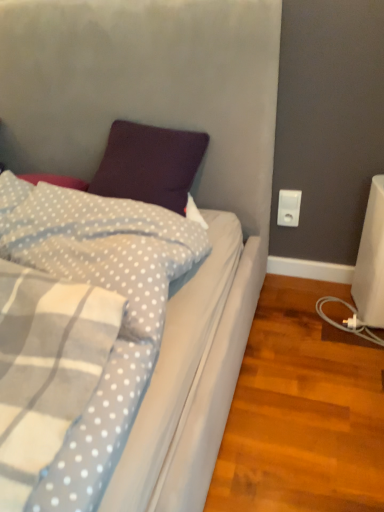
Locate an element on the screen. light purple plush pillow at upper left is located at coordinates (101, 245).

Describe the element at coordinates (101, 245) in the screenshot. The image size is (384, 512). I see `light purple plush pillow at upper left` at that location.

You are a GUI agent. You are given a task and a screenshot of the screen. Output one action in this format:
    pyautogui.click(x=<x>, y=<y>)
    Task: Click on the white plastic power plug at right
    This screenshot has height=512, width=384.
    Given the screenshot: What is the action you would take?
    pyautogui.click(x=289, y=208)

What do you see at coordinates (289, 208) in the screenshot? The width and height of the screenshot is (384, 512). I see `white plastic power plug at right` at bounding box center [289, 208].

Based on the photo, measure the distance between point (280, 204) and camera.

Point (280, 204) and camera are 5.63 feet apart.

You are a GUI agent. You are given a task and a screenshot of the screen. Output one action in this format:
    pyautogui.click(x=<x>, y=<y>)
    Task: Click on the light purple plush pillow at upper left
    
    Given the screenshot: What is the action you would take?
    pyautogui.click(x=101, y=245)

Is white plastic power plug at right to the left or to the right of light purple plush pillow at upper left in the image?

Based on their positions, white plastic power plug at right is located to the right of light purple plush pillow at upper left.

Is the position of white plastic power plug at right less distant than that of light purple plush pillow at upper left?

That is False.

Considering the positions of point (294, 206) and point (70, 242), is point (294, 206) closer or farther from the camera than point (70, 242)?

Point (294, 206) is positioned farther from the camera compared to point (70, 242).

From the image's perspective, which one is positioned higher, white plastic power plug at right or light purple plush pillow at upper left?

white plastic power plug at right appears higher in the image.

From a real-world perspective, which is physically above, white plastic power plug at right or light purple plush pillow at upper left?

light purple plush pillow at upper left, from a real-world perspective.

Which object is thinner, white plastic power plug at right or light purple plush pillow at upper left?

With smaller width is white plastic power plug at right.

Considering the relative sizes of white plastic power plug at right and light purple plush pillow at upper left in the image provided, is white plastic power plug at right taller than light purple plush pillow at upper left?

No.

Based on the photo, considering the sizes of white plastic power plug at right and light purple plush pillow at upper left in the image, is white plastic power plug at right bigger or smaller than light purple plush pillow at upper left?

In the image, white plastic power plug at right appears to be smaller than light purple plush pillow at upper left.

Is white plastic power plug at right not inside light purple plush pillow at upper left?

Indeed, white plastic power plug at right is completely outside light purple plush pillow at upper left.

Is white plastic power plug at right directly adjacent to light purple plush pillow at upper left?

No, white plastic power plug at right is not next to light purple plush pillow at upper left.

Is white plastic power plug at right positioned with its back to light purple plush pillow at upper left?

No, white plastic power plug at right is not facing the opposite direction of light purple plush pillow at upper left.

From the picture: How far apart are white plastic power plug at right and light purple plush pillow at upper left?

A distance of 32.52 inches exists between white plastic power plug at right and light purple plush pillow at upper left.

The width and height of the screenshot is (384, 512). What are the coordinates of `power plugs and sockets behind the light purple plush pillow at upper left` in the screenshot? It's located at (289, 208).

Considering the positions of objects light purple plush pillow at upper left and white plastic power plug at right in the image provided, who is more to the right, light purple plush pillow at upper left or white plastic power plug at right?

white plastic power plug at right.

Does light purple plush pillow at upper left lie in front of white plastic power plug at right?

Yes, light purple plush pillow at upper left is in front of white plastic power plug at right.

Is point (126, 330) closer to camera compared to point (291, 215)?

Yes, point (126, 330) is closer to viewer.

From the image's perspective, which is below, light purple plush pillow at upper left or white plastic power plug at right?

light purple plush pillow at upper left.

From a real-world perspective, is light purple plush pillow at upper left positioned above or below white plastic power plug at right?

light purple plush pillow at upper left is situated higher than white plastic power plug at right in the real world.

Consider the image. Is light purple plush pillow at upper left wider than white plastic power plug at right?

Yes, light purple plush pillow at upper left is wider than white plastic power plug at right.

Does light purple plush pillow at upper left have a greater height compared to white plastic power plug at right?

Correct, light purple plush pillow at upper left is much taller as white plastic power plug at right.

Which of these two, light purple plush pillow at upper left or white plastic power plug at right, is smaller?

white plastic power plug at right is smaller.

Which is correct: light purple plush pillow at upper left is inside white plastic power plug at right, or outside of it?

light purple plush pillow at upper left exists outside the volume of white plastic power plug at right.

Are light purple plush pillow at upper left and white plastic power plug at right beside each other?

They are not placed beside each other.

Could you tell me if light purple plush pillow at upper left is facing white plastic power plug at right?

No, light purple plush pillow at upper left is not turned towards white plastic power plug at right.

Measure the distance from light purple plush pillow at upper left to white plastic power plug at right.

They are 32.52 inches apart.

In order to click on pillow below the white plastic power plug at right (from the image's perspective) in this screenshot , I will do `click(101, 245)`.

At what (x,y) coordinates should I click in order to perform the action: click on power plugs and sockets above the light purple plush pillow at upper left (from the image's perspective). Please return your answer as a coordinate pair (x, y). The height and width of the screenshot is (512, 384). Looking at the image, I should click on (289, 208).

Find the location of `pillow that is in front of the white plastic power plug at right`. pillow that is in front of the white plastic power plug at right is located at coordinates (101, 245).